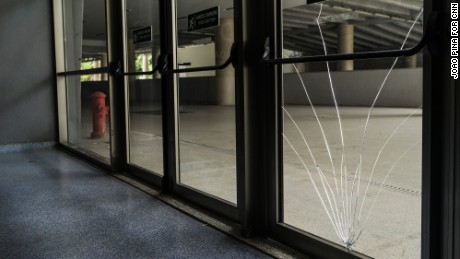
Identify the location of ceiling. (137, 12), (95, 15), (195, 5).